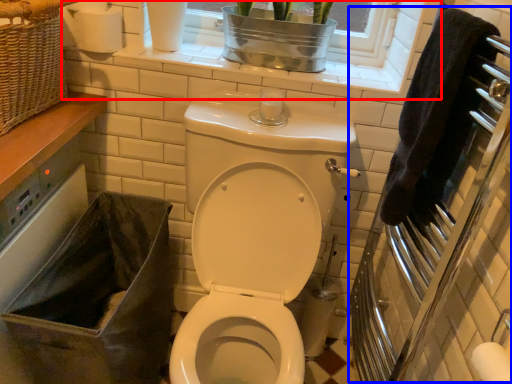
Question: Which of the following is the farthest to the observer, window frame (highlighted by a red box) or screen door (highlighted by a blue box)?

Choices:
 (A) window frame
 (B) screen door

Answer: (A)